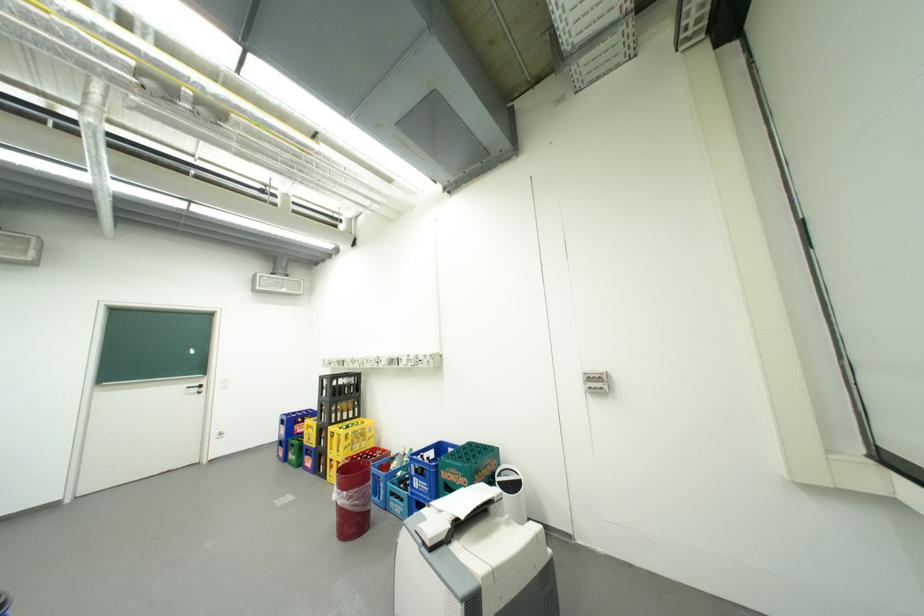
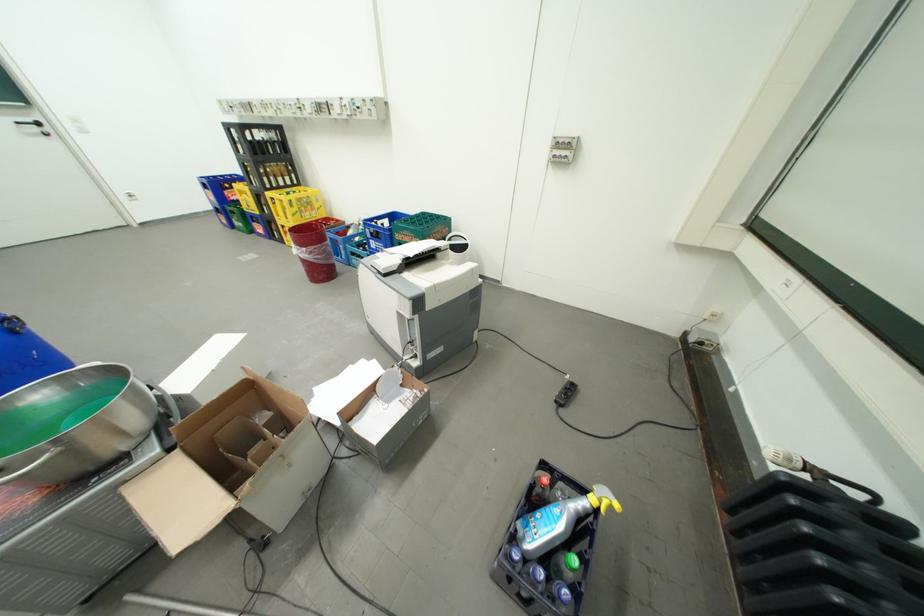
Find the pixel in the second image that matches point (360, 447) in the first image.

(310, 215)